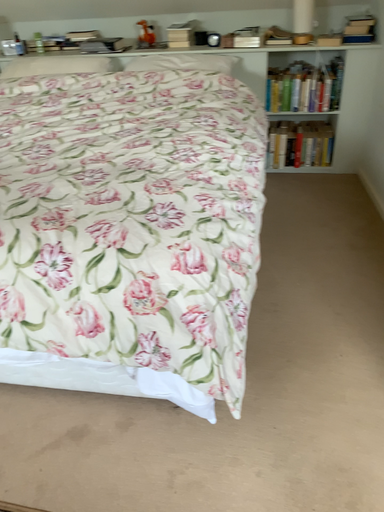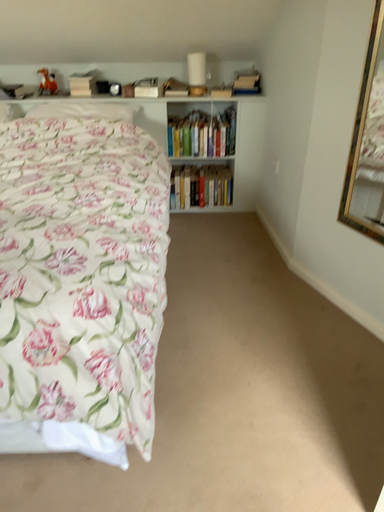
Question: How did the camera likely rotate when shooting the video?

Choices:
 (A) rotated left
 (B) rotated right

Answer: (B)